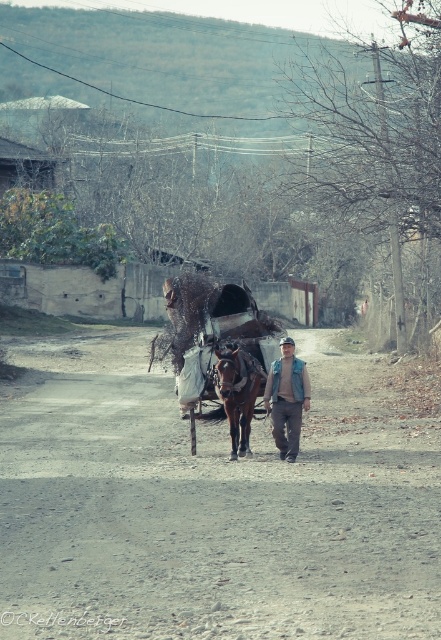
You are a traveler who wants to cross the road safely. The brown gravel dirt track at center and the brown leather horse cart at center are both in your path. Which one should you step aside to avoid?

You should step aside to avoid the brown leather horse cart at center because the brown gravel dirt track at center is on its right side, meaning the cart is closer to the traveler.

You are standing at the position of point (291, 392) and want to walk to the position of point (325, 588). Which direction should you move relative to the road?

You should move forward along the road towards point (325, 588) since it is in front of your current position at point (291, 392).